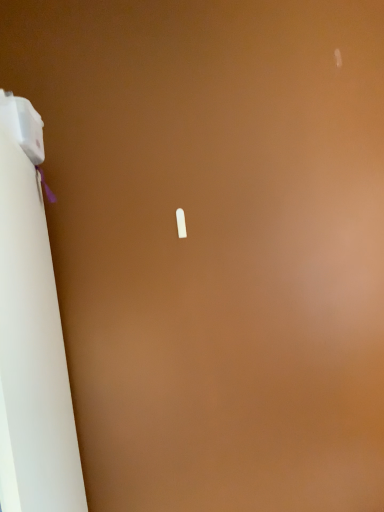
You are a GUI agent. You are given a task and a screenshot of the screen. Output one action in this format:
    pyautogui.click(x=<x>, y=<y>)
    Task: Click on the white plastic plug at center
    
    Given the screenshot: What is the action you would take?
    pyautogui.click(x=181, y=223)

Measure the distance between white plastic plug at center and camera.

white plastic plug at center is 1.04 meters away from camera.

Image resolution: width=384 pixels, height=512 pixels. Describe the element at coordinates (181, 223) in the screenshot. I see `white plastic plug at center` at that location.

Identify the location of white plastic plug at center. (181, 223).